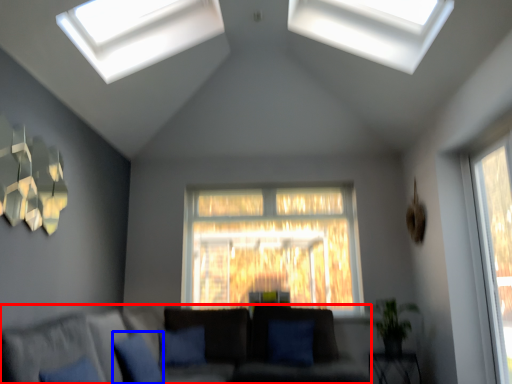
Question: Which object appears closest to the camera in this image, studio couch (highlighted by a red box) or pillow (highlighted by a blue box)?

Choices:
 (A) studio couch
 (B) pillow

Answer: (A)